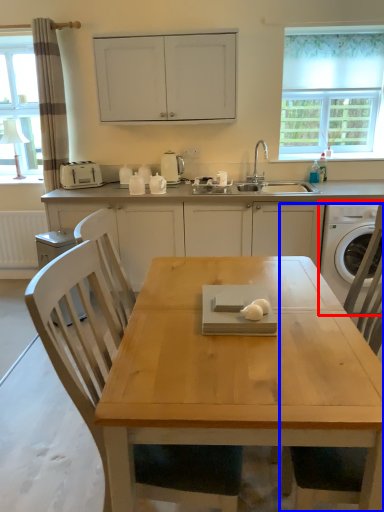
Question: Which object appears farthest to the camera in this image, washing machine (highlighted by a red box) or chair (highlighted by a blue box)?

Choices:
 (A) washing machine
 (B) chair

Answer: (A)